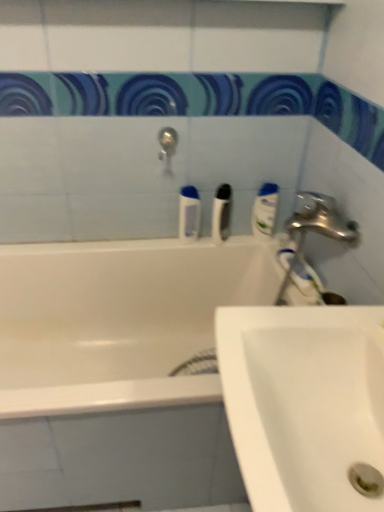
This screenshot has width=384, height=512. Identify the location of vacant space that is to the left of blue glossy mouthwash at center, the first mouthwash from the left. (154, 242).